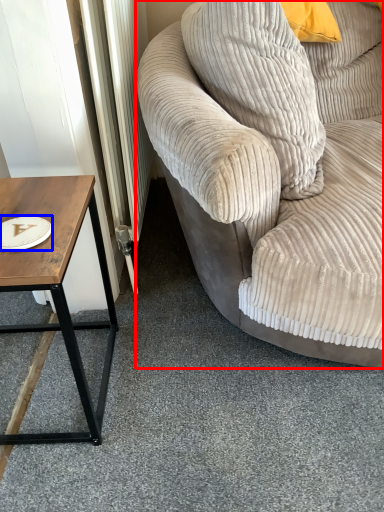
Question: Which object is further to the camera taking this photo, studio couch (highlighted by a red box) or paper plate (highlighted by a blue box)?

Choices:
 (A) studio couch
 (B) paper plate

Answer: (B)